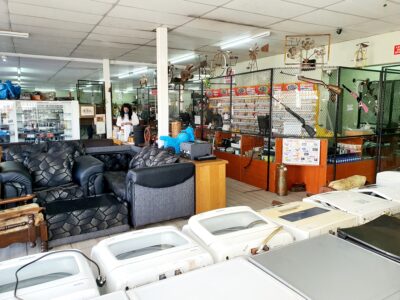
Locate an element on the screen. The height and width of the screenshot is (300, 400). shop lights is located at coordinates (19, 70), (19, 79), (20, 85), (136, 69), (89, 86), (183, 56), (240, 41), (17, 34).